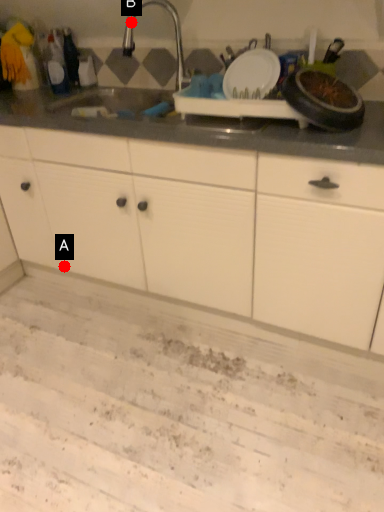
Question: Two points are circled on the image, labeled by A and B beside each circle. Which point is closer to the camera?

Choices:
 (A) A is closer
 (B) B is closer

Answer: (B)